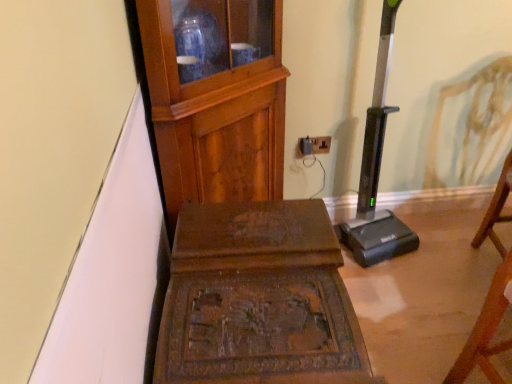
Question: Is wooden chair at right, arranged as the third furniture when viewed from the left, next to black plastic outlet at center?

Choices:
 (A) yes
 (B) no

Answer: (B)

Question: From the image's perspective, would you say wooden chair at right, which appears as the first furniture when viewed from the right, is shown under black plastic outlet at center?

Choices:
 (A) no
 (B) yes

Answer: (B)

Question: Considering the relative sizes of wooden chair at right, arranged as the third furniture when viewed from the left, and black plastic outlet at center in the image provided, is wooden chair at right, arranged as the third furniture when viewed from the left, bigger than black plastic outlet at center?

Choices:
 (A) yes
 (B) no

Answer: (A)

Question: Is wooden chair at right, which appears as the first furniture when viewed from the right, thinner than black plastic outlet at center?

Choices:
 (A) no
 (B) yes

Answer: (A)

Question: From the image's perspective, is wooden chair at right, which appears as the first furniture when viewed from the right, over black plastic outlet at center?

Choices:
 (A) no
 (B) yes

Answer: (A)

Question: Is wooden chair at right, arranged as the third furniture when viewed from the left, facing towards black plastic outlet at center?

Choices:
 (A) no
 (B) yes

Answer: (A)

Question: From a real-world perspective, is carved wood table at center, marked as the second furniture in a left-to-right arrangement, physically below black plastic outlet at center?

Choices:
 (A) yes
 (B) no

Answer: (A)

Question: Would you say black plastic outlet at center is part of carved wood table at center, the second furniture in the right-to-left sequence,'s contents?

Choices:
 (A) no
 (B) yes

Answer: (A)

Question: Is carved wood table at center, marked as the second furniture in a left-to-right arrangement, behind black plastic outlet at center?

Choices:
 (A) yes
 (B) no

Answer: (B)

Question: Considering the relative sizes of carved wood table at center, the second furniture in the right-to-left sequence, and black plastic outlet at center in the image provided, is carved wood table at center, the second furniture in the right-to-left sequence, wider than black plastic outlet at center?

Choices:
 (A) no
 (B) yes

Answer: (B)

Question: Does carved wood table at center, the second furniture in the right-to-left sequence, appear on the right side of black plastic outlet at center?

Choices:
 (A) yes
 (B) no

Answer: (B)

Question: Does carved wood table at center, marked as the second furniture in a left-to-right arrangement, have a greater height compared to black plastic outlet at center?

Choices:
 (A) yes
 (B) no

Answer: (A)

Question: Is wooden chair at right, which appears as the first furniture when viewed from the right, further to camera compared to carved wood table at center, the second furniture in the right-to-left sequence?

Choices:
 (A) no
 (B) yes

Answer: (A)